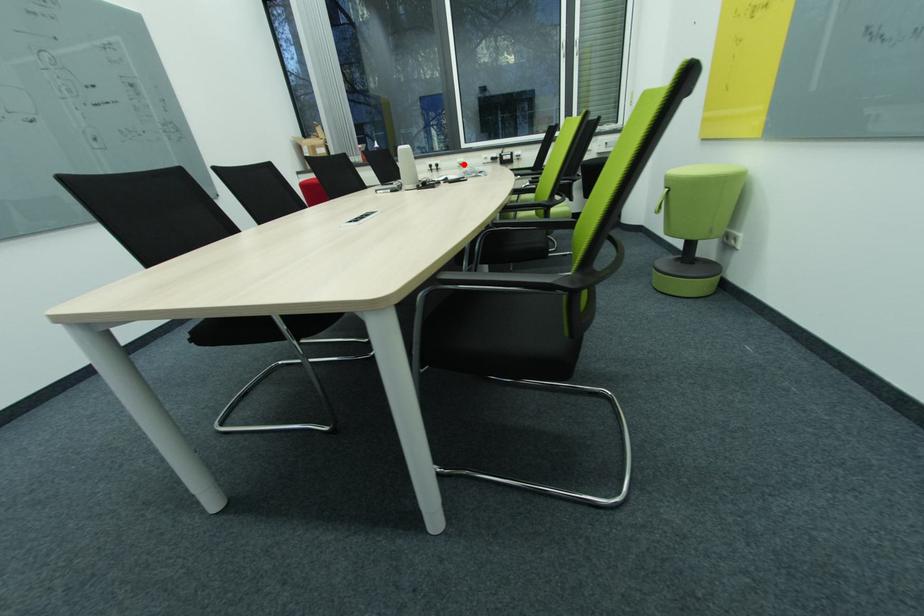
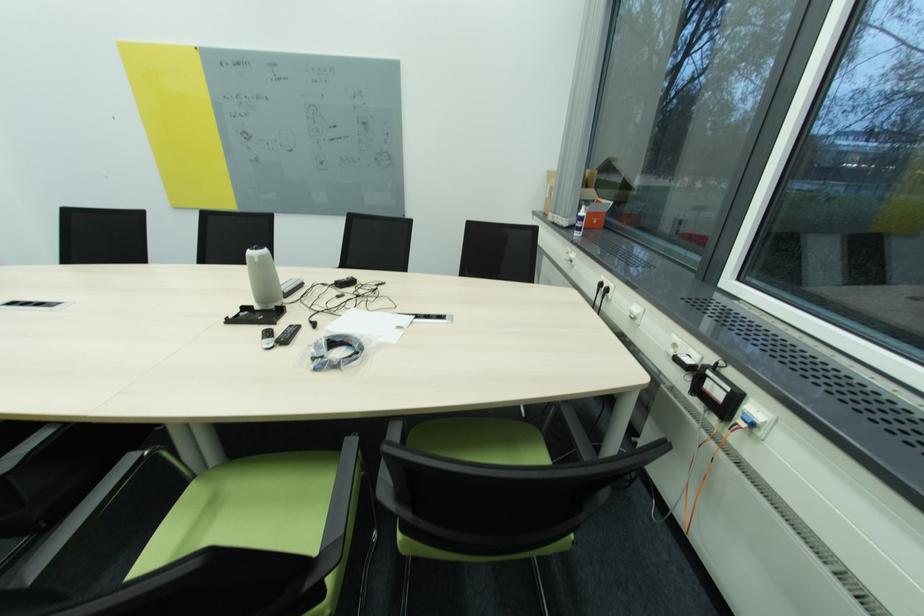
Find the pixel in the second image that matches the highlighted location in the first image.

(636, 314)